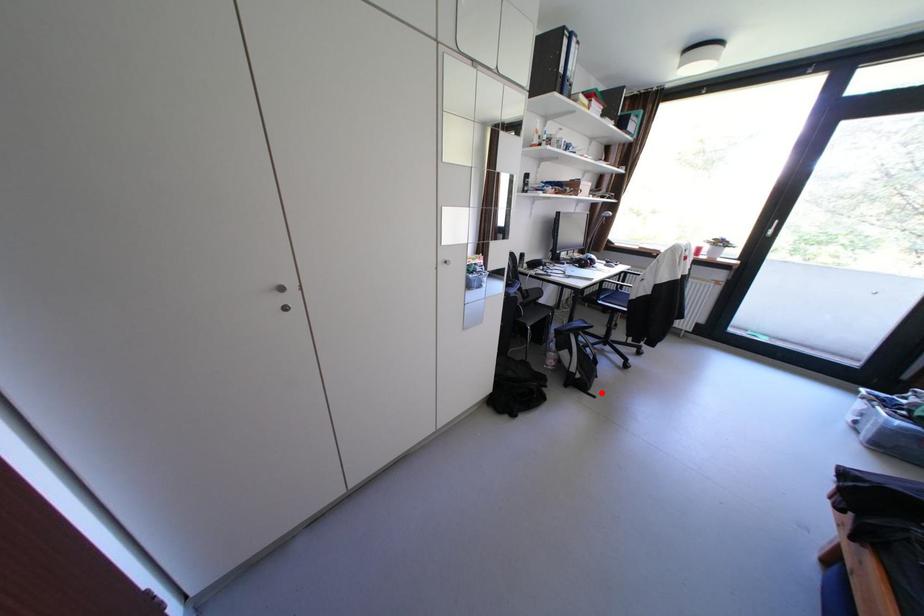
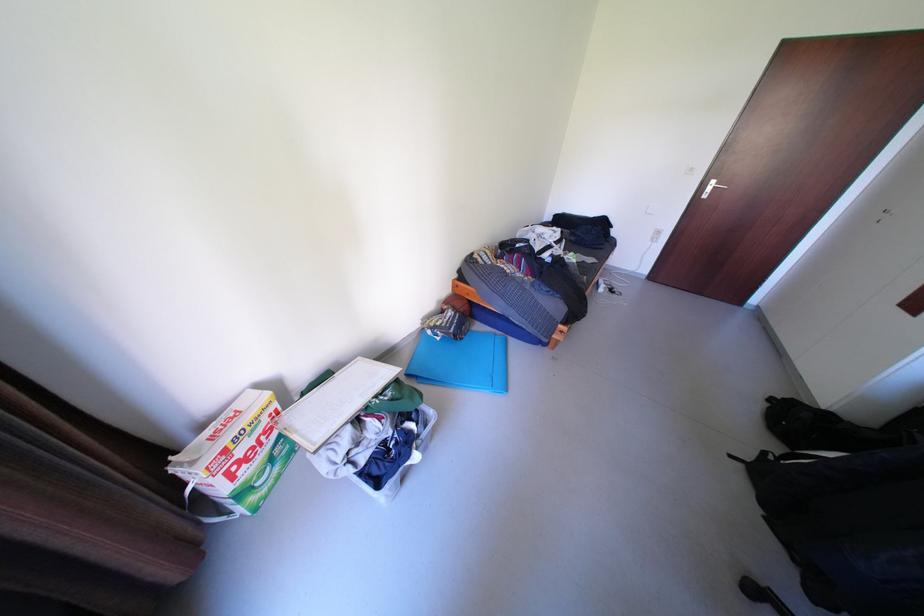
Question: I am providing you with two images of the same scene from different viewpoints. In image1, a red point is highlighted. Considering the same 3D point in image2, which of the following is correct?

Choices:
 (A) It is closer
 (B) It is farther

Answer: (A)